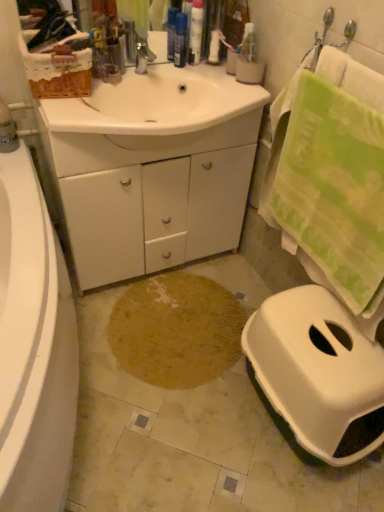
Question: Choose the correct answer: Is white plastic bottle at upper center, which is the 3th toiletry in left-to-right order, inside white glossy cabinet at center or outside it?

Choices:
 (A) inside
 (B) outside

Answer: (B)

Question: From a real-world perspective, is white plastic bottle at upper center, marked as the first toiletry in a right-to-left arrangement, positioned above or below white glossy cabinet at center?

Choices:
 (A) above
 (B) below

Answer: (A)

Question: Considering the real-world distances, which object is farthest from the white glossy tube at upper center, which is counted as the second toiletry, starting from the right?

Choices:
 (A) brown textured rug at center
 (B) white plastic toilet at lower right
 (C) green textured towel at right
 (D) white glossy sink at center
 (E) white glossy cabinet at center

Answer: (B)

Question: Estimate the real-world distances between objects in this image. Which object is farther from the brown textured rug at center?

Choices:
 (A) white plastic toilet at lower right
 (B) green textured towel at right
 (C) white plastic bottle at upper center, which is the 3th toiletry in left-to-right order
 (D) white glossy cabinet at center
 (E) translucent plastic bottles at upper center, marked as the first toiletry in a left-to-right arrangement

Answer: (C)